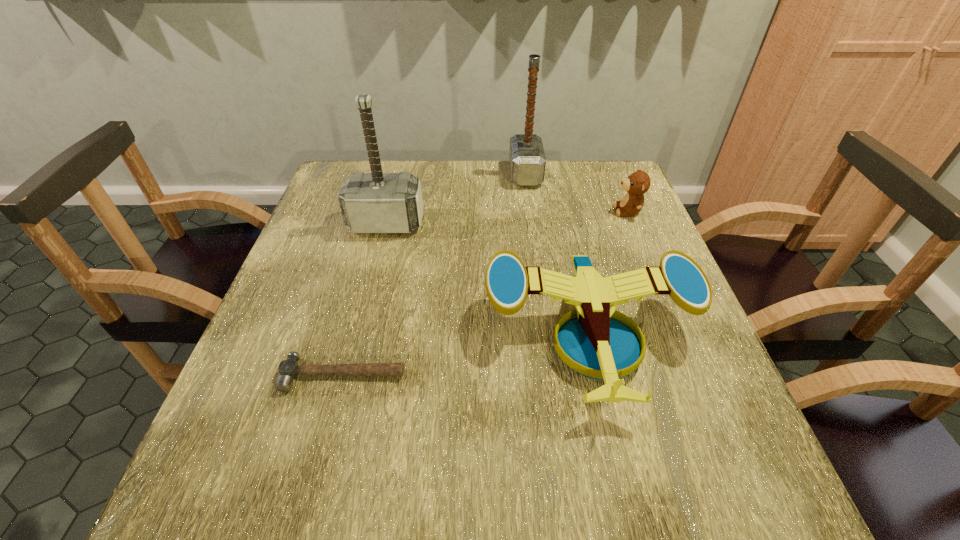
This screenshot has width=960, height=540. Identify the location of object at the far right corner. (638, 183).

Identify the location of vacant space at the far edge of the desktop. The width and height of the screenshot is (960, 540). (433, 185).

Where is `free space at the near edge of the desktop`? free space at the near edge of the desktop is located at coordinates (581, 511).

The width and height of the screenshot is (960, 540). Find the location of `vacant point at the left edge`. vacant point at the left edge is located at coordinates (307, 300).

Find the location of `free space at the right edge of the desktop`. free space at the right edge of the desktop is located at coordinates (641, 257).

This screenshot has height=540, width=960. I want to click on free space at the far left corner of the desktop, so (348, 173).

You are a GUI agent. You are given a task and a screenshot of the screen. Output one action in this format:
    pyautogui.click(x=<x>, y=<y>)
    Task: Click on the vacant region at the near left corner of the desktop
    The height and width of the screenshot is (540, 960).
    Given the screenshot: What is the action you would take?
    pyautogui.click(x=189, y=493)

The image size is (960, 540). Identify the location of vacant space at the far right corner of the desktop. (621, 170).

At what (x,y) coordinates should I click in order to perform the action: click on vacant space in between the rightmost hammer and the second nearest hammer. Please return your answer as a coordinate pair (x, y). Looking at the image, I should click on (456, 199).

Locate an element on the screen. This screenshot has height=540, width=960. free area in between the shortest object and the second farthest hammer is located at coordinates (365, 299).